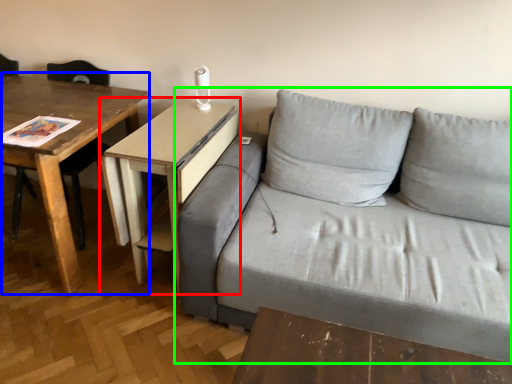
Question: Which object is the farthest from table (highlighted by a red box)? Choose among these: table (highlighted by a blue box) or studio couch (highlighted by a green box).

Choices:
 (A) table
 (B) studio couch

Answer: (B)